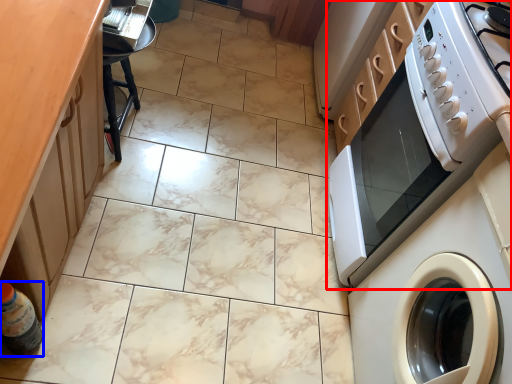
Question: Which object is closer to the camera taking this photo, home appliance (highlighted by a red box) or bottle (highlighted by a blue box)?

Choices:
 (A) home appliance
 (B) bottle

Answer: (B)